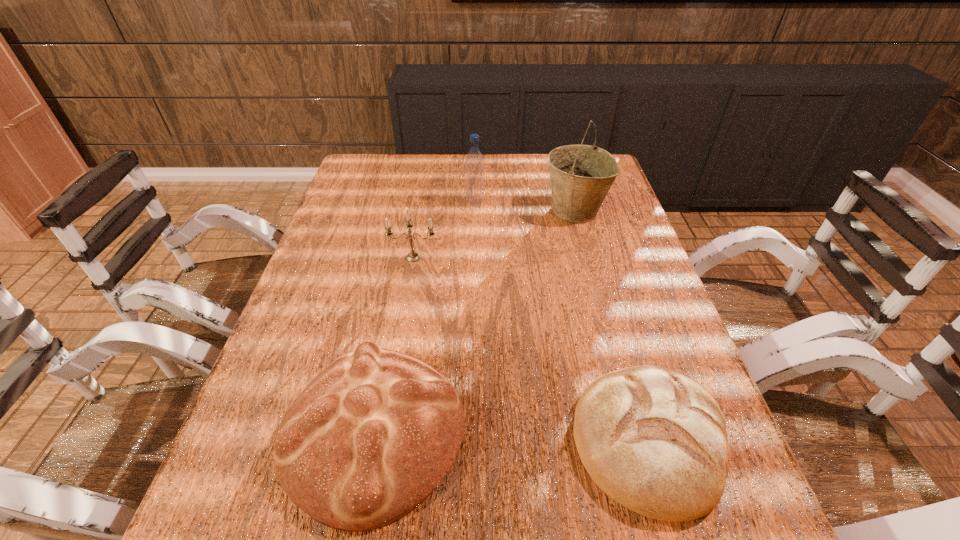
This screenshot has height=540, width=960. Find the location of `the tallest object`. the tallest object is located at coordinates (581, 175).

Locate an element on the screen. the fourth shortest object is located at coordinates coord(474,163).

Locate an element on the screen. The height and width of the screenshot is (540, 960). candle is located at coordinates (412, 256).

Locate an element on the screen. the third shortest object is located at coordinates click(412, 256).

I want to click on the left bread, so click(x=373, y=434).

Locate an element on the screen. the fourth tallest object is located at coordinates (373, 434).

Identify the location of the shorter bread. The height and width of the screenshot is (540, 960). (653, 439).

Where is `the right bread`? This screenshot has height=540, width=960. the right bread is located at coordinates (653, 439).

Identify the location of vacant space located 0.060m on the left of the wine bucket. The height and width of the screenshot is (540, 960). (523, 210).

Find the location of a particular element. The image size is (960, 540). vacant space located on the right of the fourth shortest object is located at coordinates (554, 203).